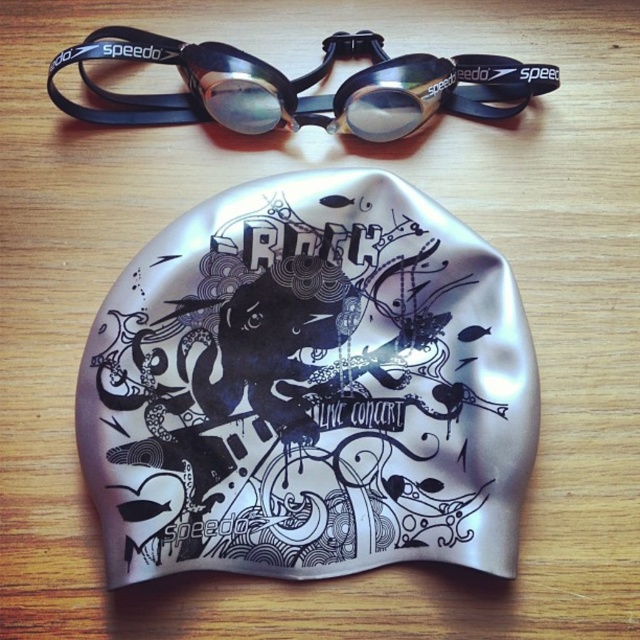
From the picture: Is silver matte swim cap at center taller than black rubber goggles at upper center?

Yes.

Is the position of silver matte swim cap at center less distant than that of black rubber goggles at upper center?

Yes, it is.

Is point (432, 202) positioned in front of point (502, 118)?

That is True.

The height and width of the screenshot is (640, 640). Find the location of `silver matte swim cap at center`. silver matte swim cap at center is located at coordinates (308, 387).